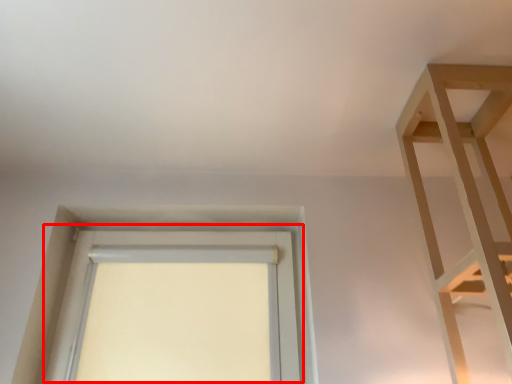
Question: From the image's perspective, where is window (annotated by the red box) located relative to shelf?

Choices:
 (A) below
 (B) above

Answer: (A)